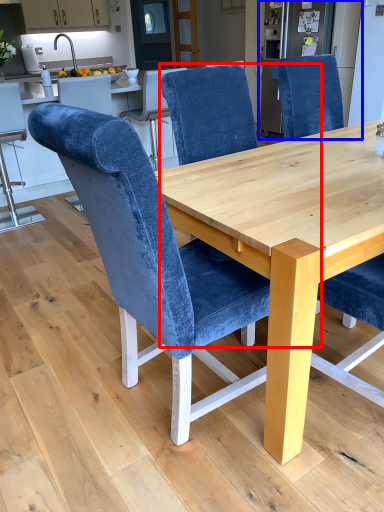
Question: Which object appears closest to the camera in this image, chair (highlighted by a red box) or appliance (highlighted by a blue box)?

Choices:
 (A) chair
 (B) appliance

Answer: (A)